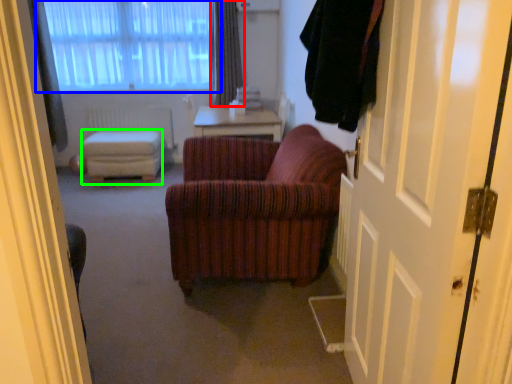
Question: Based on their relative distances, which object is nearer to curtain (highlighted by a red box)? Choose from window (highlighted by a blue box) and stool (highlighted by a green box).

Choices:
 (A) window
 (B) stool

Answer: (A)